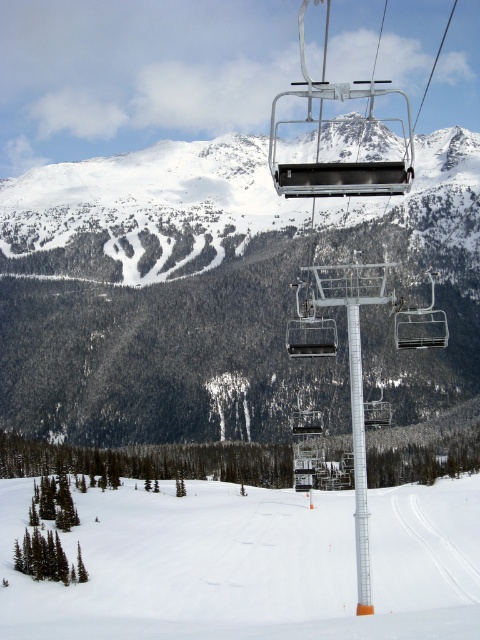
Question: Is white snow ski slope at lower left positioned before metallic silver chair at center?

Choices:
 (A) yes
 (B) no

Answer: (A)

Question: Which point is closer to the camera?

Choices:
 (A) white plastic pole at center
 (B) snowy forested mountain at center
 (C) white snow ski slope at lower left

Answer: (C)

Question: Does white snow ski slope at lower left come behind metallic silver chair at center?

Choices:
 (A) no
 (B) yes

Answer: (A)

Question: Which of the following is the closest to the observer?

Choices:
 (A) snowy forested mountain at center
 (B) metallic silver chair at center
 (C) white snow ski slope at lower left
 (D) white plastic pole at center

Answer: (C)

Question: Which point is closer to the camera?

Choices:
 (A) (423, 339)
 (B) (414, 388)

Answer: (B)

Question: Does snowy forested mountain at center appear on the right side of white plastic pole at center?

Choices:
 (A) yes
 (B) no

Answer: (B)